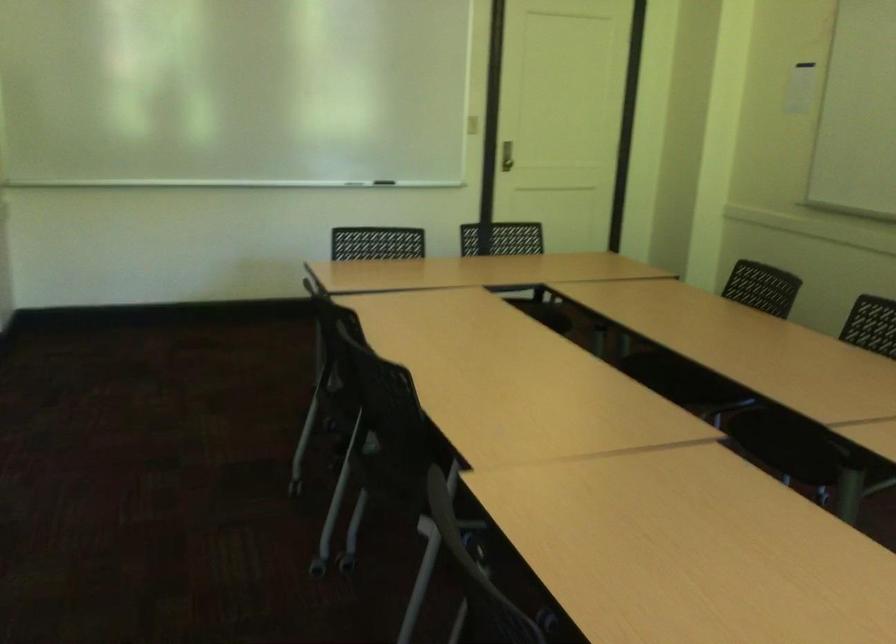
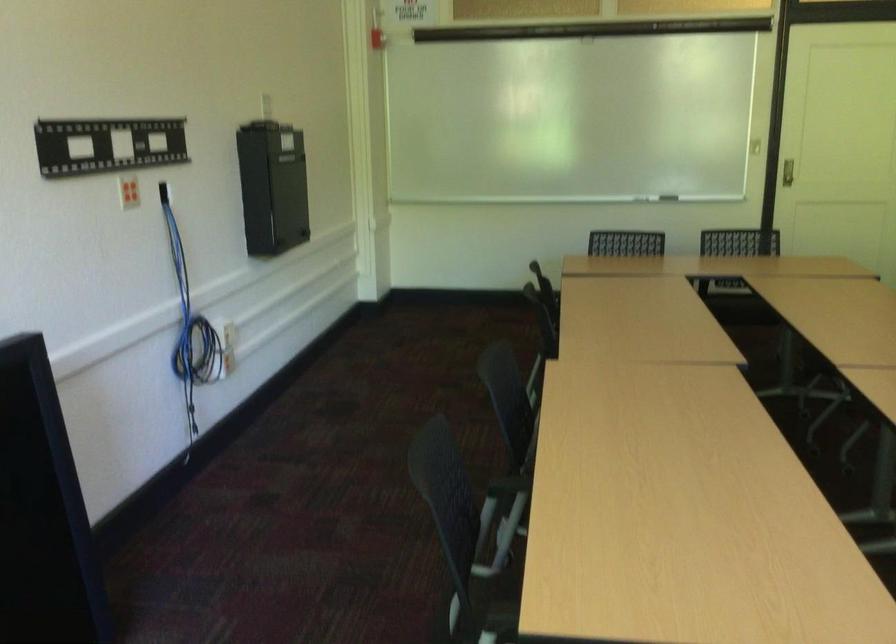
Question: I am providing you with two images of the same scene from different viewpoints. After the viewpoint changes to image2, which objects are now occluded?

Choices:
 (A) razor power button
 (B) recessed door handle
 (C) whiteboard eraser
 (D) metal door handle

Answer: (D)